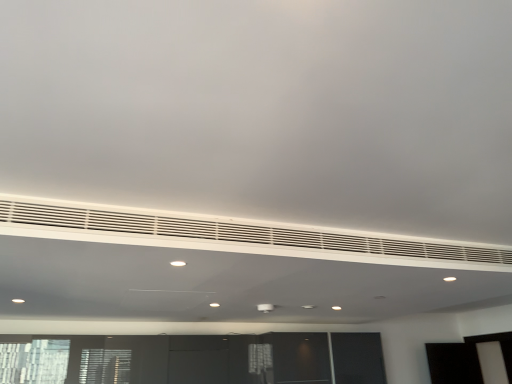
Question: From a real-world perspective, is white matte air conditioning at center above or below white matte vent at center?

Choices:
 (A) below
 (B) above

Answer: (B)

Question: Is white matte air conditioning at center to the left or to the right of white matte vent at center in the image?

Choices:
 (A) right
 (B) left

Answer: (A)

Question: In terms of size, does white matte air conditioning at center appear bigger or smaller than white matte vent at center?

Choices:
 (A) big
 (B) small

Answer: (B)

Question: Looking at their shapes, would you say white matte vent at center is wider or thinner than white matte air conditioning at center?

Choices:
 (A) wide
 (B) thin

Answer: (A)

Question: Considering the positions of white matte vent at center and white matte air conditioning at center in the image, is white matte vent at center bigger or smaller than white matte air conditioning at center?

Choices:
 (A) big
 (B) small

Answer: (A)

Question: Is white matte vent at center to the left or to the right of white matte air conditioning at center in the image?

Choices:
 (A) right
 (B) left

Answer: (B)

Question: From a real-world perspective, is white matte vent at center positioned above or below white matte air conditioning at center?

Choices:
 (A) below
 (B) above

Answer: (A)